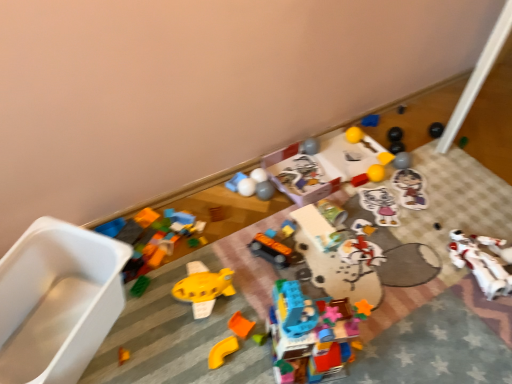
You are a GUI agent. You are given a task and a screenshot of the screen. Output one action in this format:
    pyautogui.click(x=<x>, y=<y>)
    Task: Click on the vacant space in front of yellow matte toy boat at center, positioned as the second toy in left-to-right order
    The height and width of the screenshot is (384, 512).
    Given the screenshot: What is the action you would take?
    pyautogui.click(x=196, y=352)